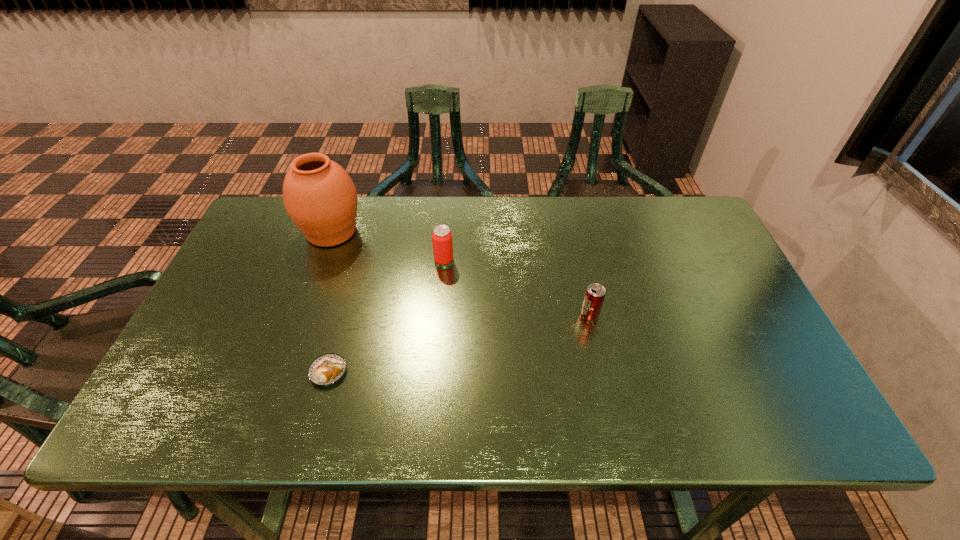
The width and height of the screenshot is (960, 540). In order to click on vacant region located 0.260m on the left of the nearest object in this screenshot , I will do `click(196, 372)`.

I want to click on object situated at the far edge, so click(x=319, y=196).

In order to click on object at the left edge in this screenshot , I will do `click(319, 196)`.

This screenshot has height=540, width=960. I want to click on object at the far left corner, so (319, 196).

Find the location of a particular element. vacant area at the far edge is located at coordinates (556, 233).

You are a GUI agent. You are given a task and a screenshot of the screen. Output one action in this format:
    pyautogui.click(x=<x>, y=<y>)
    Task: Click on the free space at the left edge
    Image resolution: width=960 pixels, height=540 pixels.
    Given the screenshot: What is the action you would take?
    pyautogui.click(x=231, y=321)

Identify the location of vacant space at the right edge of the desktop. This screenshot has height=540, width=960. (706, 266).

In the image, there is a desktop. Find the location of `vacant space at the near left corner`. vacant space at the near left corner is located at coordinates (161, 401).

This screenshot has height=540, width=960. In the image, there is a desktop. In order to click on vacant space at the far right corner in this screenshot , I will do [666, 237].

Image resolution: width=960 pixels, height=540 pixels. What are the coordinates of `vacant area that lies between the shortest object and the right beer can` in the screenshot? It's located at (459, 343).